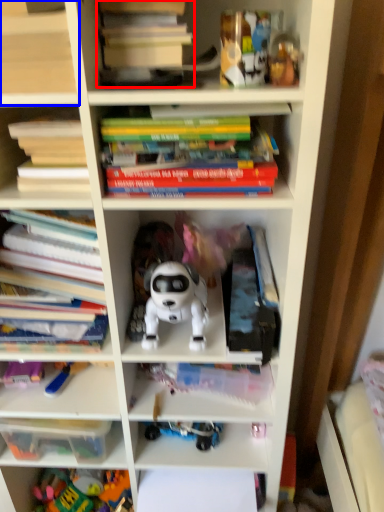
Question: Which of the following is the farthest to the observer, book (highlighted by a red box) or shelf (highlighted by a blue box)?

Choices:
 (A) book
 (B) shelf

Answer: (A)